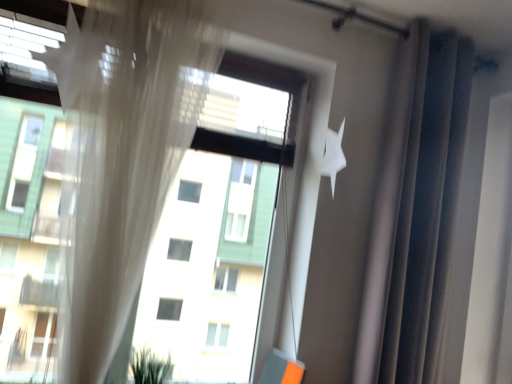
This screenshot has width=512, height=384. What do you see at coordinates (120, 157) in the screenshot?
I see `transparent fabric at left` at bounding box center [120, 157].

At what (x,y) coordinates should I click in order to perform the action: click on transparent fabric at left. Please return your answer as a coordinate pair (x, y). The image size is (512, 384). Looking at the image, I should click on (120, 157).

The height and width of the screenshot is (384, 512). Find the location of `transparent fabric at left`. transparent fabric at left is located at coordinates (120, 157).